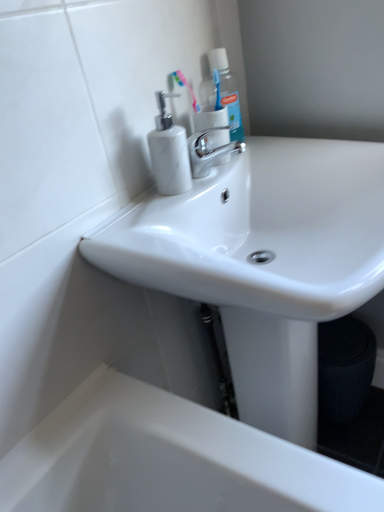
Question: From the image's perspective, is pink plastic toothbrush at upper center above or below translucent plastic mouthwash at upper center?

Choices:
 (A) below
 (B) above

Answer: (A)

Question: In terms of width, does pink plastic toothbrush at upper center look wider or thinner when compared to translucent plastic mouthwash at upper center?

Choices:
 (A) wide
 (B) thin

Answer: (B)

Question: Which is farther from the translucent plastic mouthwash at upper center?

Choices:
 (A) white glossy toilet paper at upper center
 (B) pink plastic toothbrush at upper center
 (C) polished chrome faucet at center
 (D) white glossy sink at center
 (E) white marble soap dispenser at upper left

Answer: (D)

Question: Based on their relative distances, which object is nearer to the white glossy sink at center?

Choices:
 (A) white glossy toilet paper at upper center
 (B) white marble soap dispenser at upper left
 (C) pink plastic toothbrush at upper center
 (D) polished chrome faucet at center
 (E) translucent plastic mouthwash at upper center

Answer: (D)